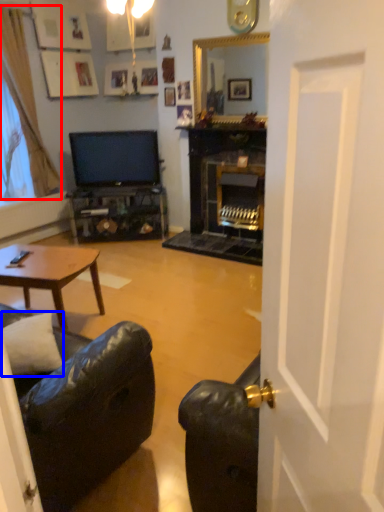
Question: Which object appears closest to the camera in this image, curtain (highlighted by a red box) or pillow (highlighted by a blue box)?

Choices:
 (A) curtain
 (B) pillow

Answer: (B)